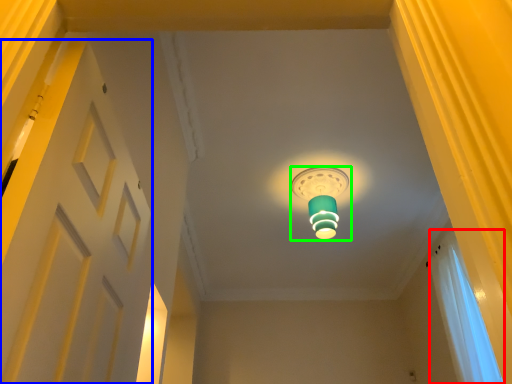
Question: Based on their relative distances, which object is nearer to curtain (highlighted by a red box)? Choose from door (highlighted by a blue box) and lamp (highlighted by a green box).

Choices:
 (A) door
 (B) lamp

Answer: (B)